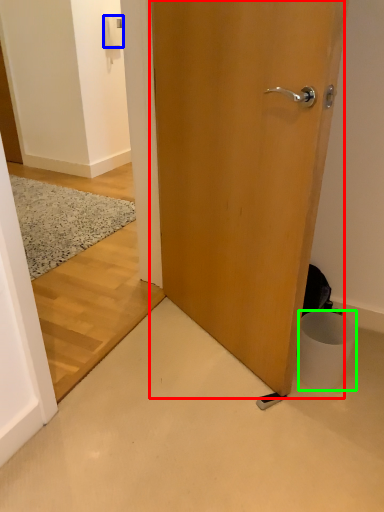
Question: Considering the real-world distances, which object is farthest from door (highlighted by a red box)? light switch (highlighted by a blue box) or trash bin/can (highlighted by a green box)?

Choices:
 (A) light switch
 (B) trash bin/can

Answer: (A)